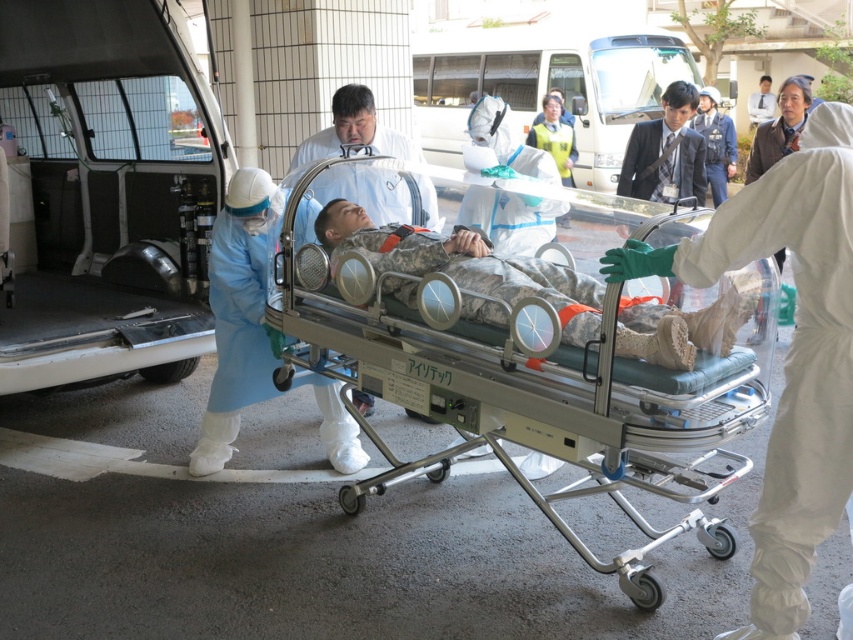
Which is behind, point (753, 394) or point (502, 275)?

Positioned behind is point (502, 275).

Does silver metallic stretcher at center lie in front of camouflage fabric baby at center?

Yes, silver metallic stretcher at center is in front of camouflage fabric baby at center.

You are a GUI agent. You are given a task and a screenshot of the screen. Output one action in this format:
    pyautogui.click(x=<x>, y=<y>)
    Task: Click on the silver metallic stretcher at center
    This screenshot has width=853, height=640.
    Given the screenshot: What is the action you would take?
    [537, 368]

Locate an element on the screen. silver metallic stretcher at center is located at coordinates (537, 368).